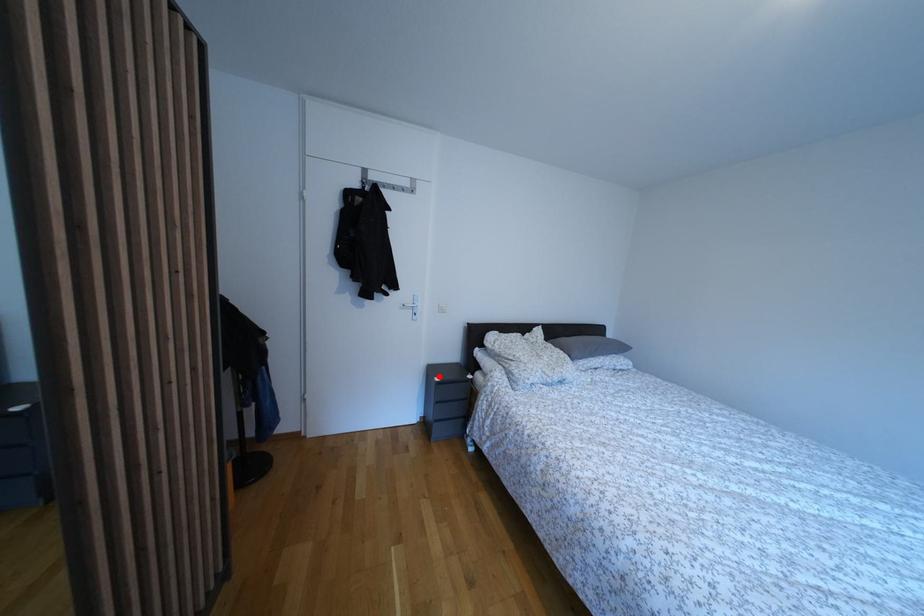
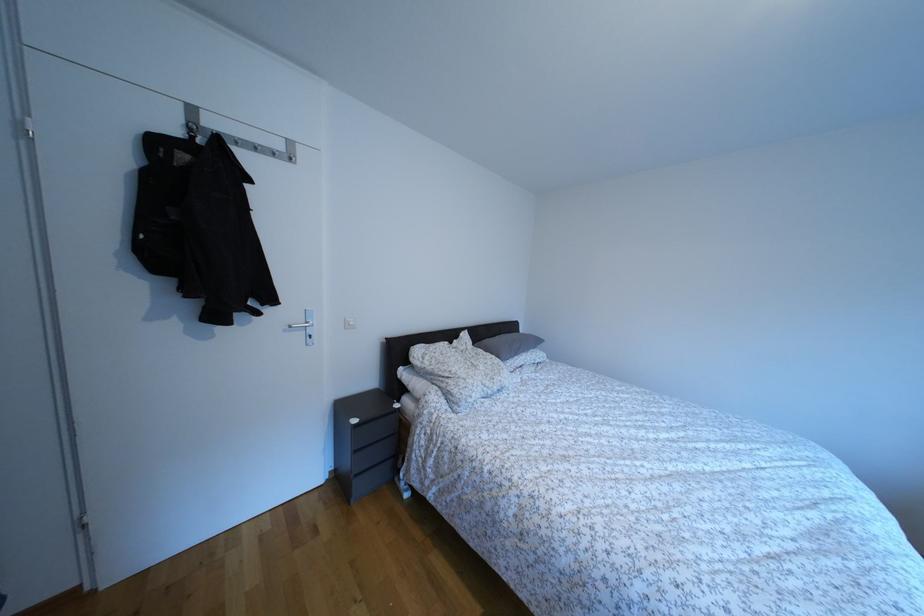
Where in the second image is the point corresponding to the highlighted location from the first image?

(349, 413)